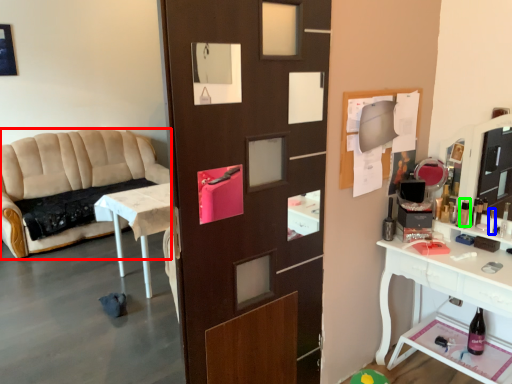
Question: Which object is positioned farthest from studio couch (highlighted by a red box)? Select from toiletry (highlighted by a blue box) and toiletry (highlighted by a green box).

Choices:
 (A) toiletry
 (B) toiletry

Answer: (A)